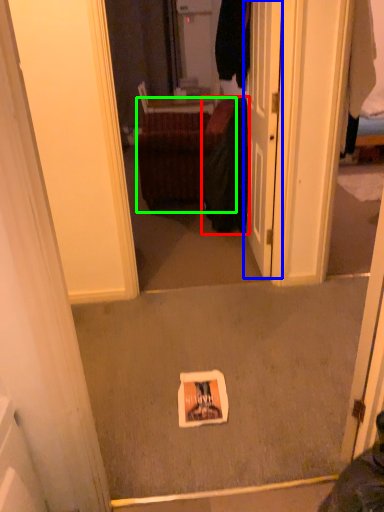
Question: Based on their relative distances, which object is nearer to clothing (highlighted by a red box)? Choose from door (highlighted by a blue box) and furniture (highlighted by a green box).

Choices:
 (A) door
 (B) furniture

Answer: (B)